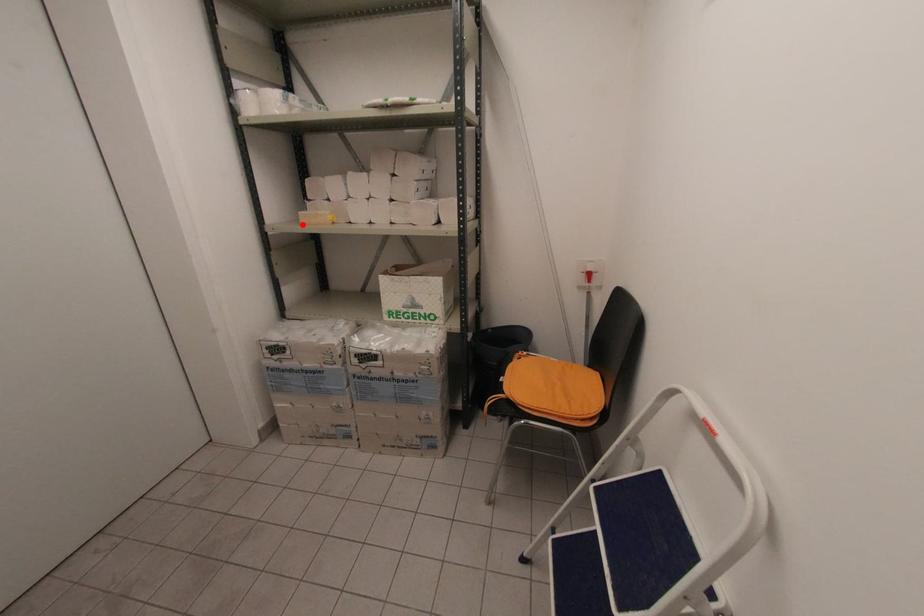
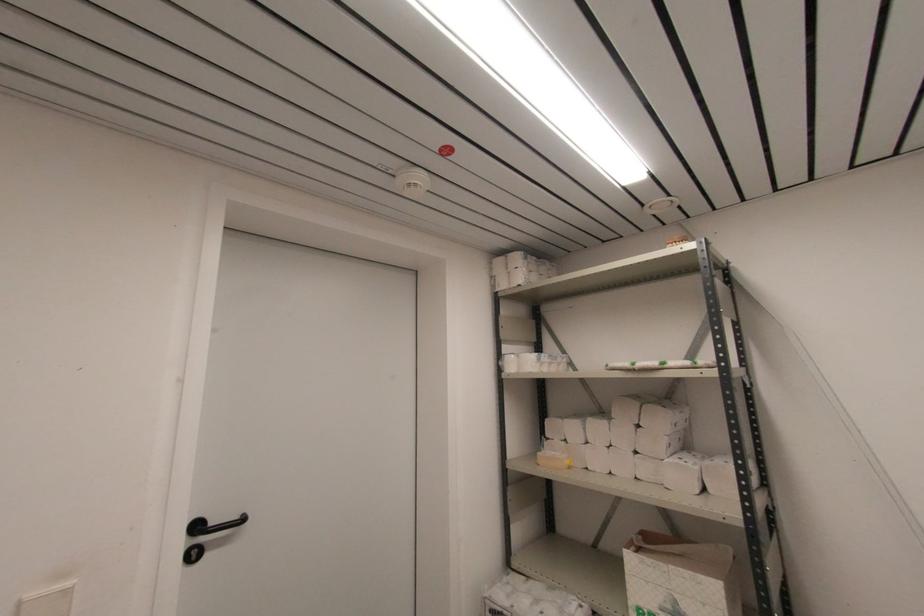
Locate, in the second image, the point that corresponds to the highlighted location in the first image.

(540, 464)